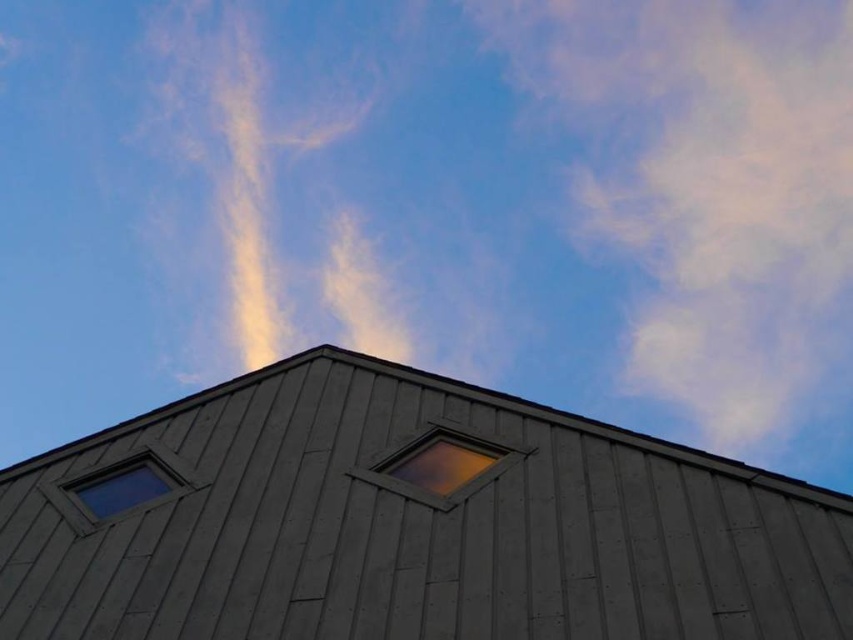
Does gray wood roof at center appear under matte wooden window at center?

Yes.

Does gray wood roof at center appear on the left side of matte wooden window at center?

Correct, you'll find gray wood roof at center to the left of matte wooden window at center.

Does point (691, 557) lie in front of point (463, 493)?

Yes, it is in front of point (463, 493).

I want to click on gray wood roof at center, so click(x=415, y=525).

Is matte wooden window at center bigger than transparent glass window at lower left?

Indeed, matte wooden window at center has a larger size compared to transparent glass window at lower left.

Which is below, matte wooden window at center or transparent glass window at lower left?

transparent glass window at lower left is lower down.

This screenshot has height=640, width=853. Identify the location of matte wooden window at center. pos(440,467).

I want to click on matte wooden window at center, so click(440, 467).

Between gray wood roof at center and transparent glass window at lower left, which one appears on the right side from the viewer's perspective?

gray wood roof at center is more to the right.

In the scene shown: Between gray wood roof at center and transparent glass window at lower left, which one has more height?

With more height is gray wood roof at center.

Identify the location of gray wood roof at center. This screenshot has width=853, height=640. (415, 525).